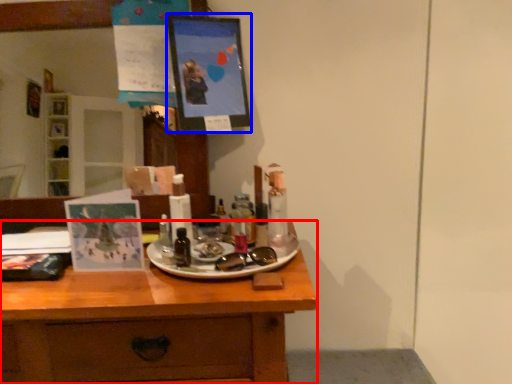
Question: Among these objects, which one is nearest to the camera, desk (highlighted by a red box) or picture frame (highlighted by a blue box)?

Choices:
 (A) desk
 (B) picture frame

Answer: (A)